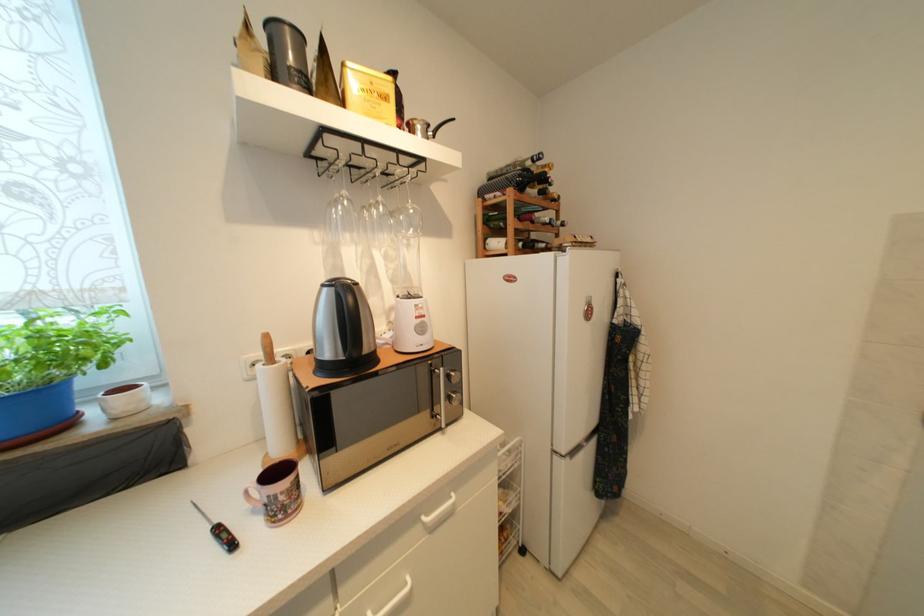
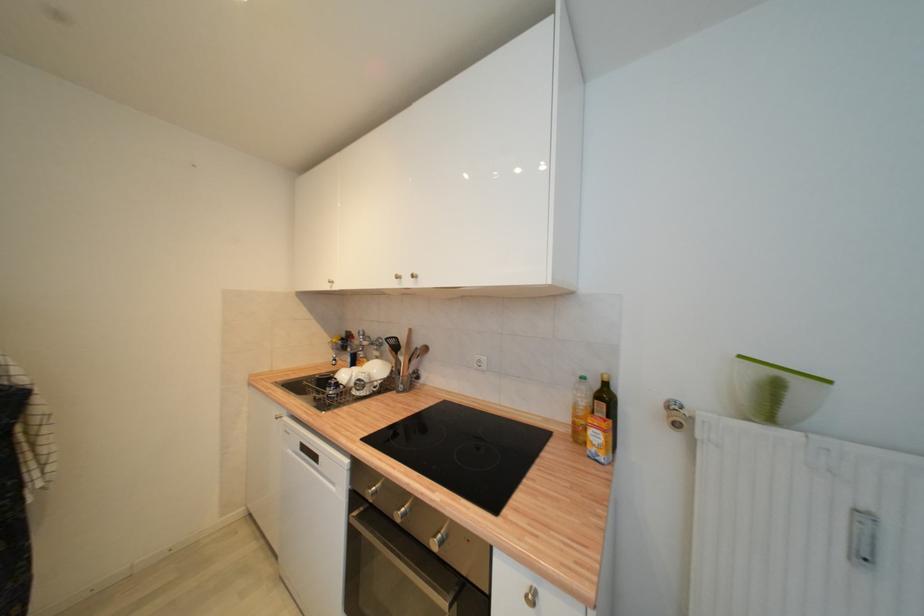
Question: Based on the continuous images, in which direction is the camera rotating? Reply with the corresponding letter.

Choices:
 (A) Left
 (B) Right
 (C) Up
 (D) Down

Answer: (B)